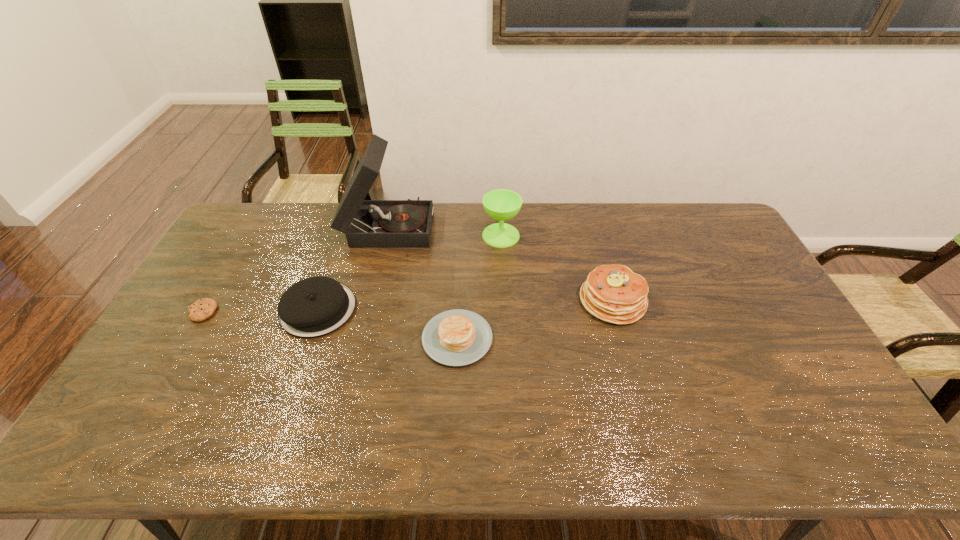
Identify the location of vacant area at the near edge of the desktop. (545, 439).

Locate an element on the screen. free space at the left edge is located at coordinates (191, 288).

The width and height of the screenshot is (960, 540). I want to click on vacant position at the right edge of the desktop, so click(776, 363).

This screenshot has width=960, height=540. Identify the location of vacant area between the tallest object and the fourth tallest object. (353, 267).

The height and width of the screenshot is (540, 960). Find the location of `free area in between the leftmost object and the third tallest object`. free area in between the leftmost object and the third tallest object is located at coordinates (408, 306).

Where is `vacant region between the second tallest object and the fourth tallest object`? The height and width of the screenshot is (540, 960). vacant region between the second tallest object and the fourth tallest object is located at coordinates 410,272.

Identify the location of vacant area that lies between the shortest pancake and the phonograph_record. The height and width of the screenshot is (540, 960). (422, 282).

Where is `unoccupied area between the wineglass and the phonograph_record`? The width and height of the screenshot is (960, 540). unoccupied area between the wineglass and the phonograph_record is located at coordinates (444, 231).

You are a GUI agent. You are given a task and a screenshot of the screen. Output one action in this format:
    pyautogui.click(x=<x>, y=<y>)
    Task: Click on the vacant area that lies between the second pancake from right to left and the fifth shortest object
    Image resolution: width=960 pixels, height=540 pixels.
    Given the screenshot: What is the action you would take?
    pyautogui.click(x=479, y=287)

This screenshot has height=540, width=960. What are the coordinates of `unoccupied position between the leftmost object and the tallest pancake` in the screenshot? It's located at (408, 306).